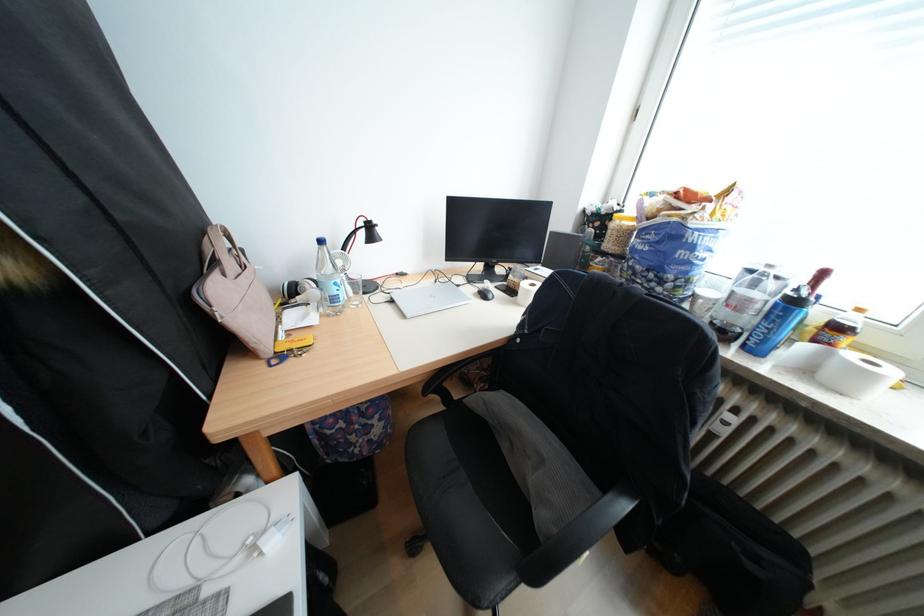
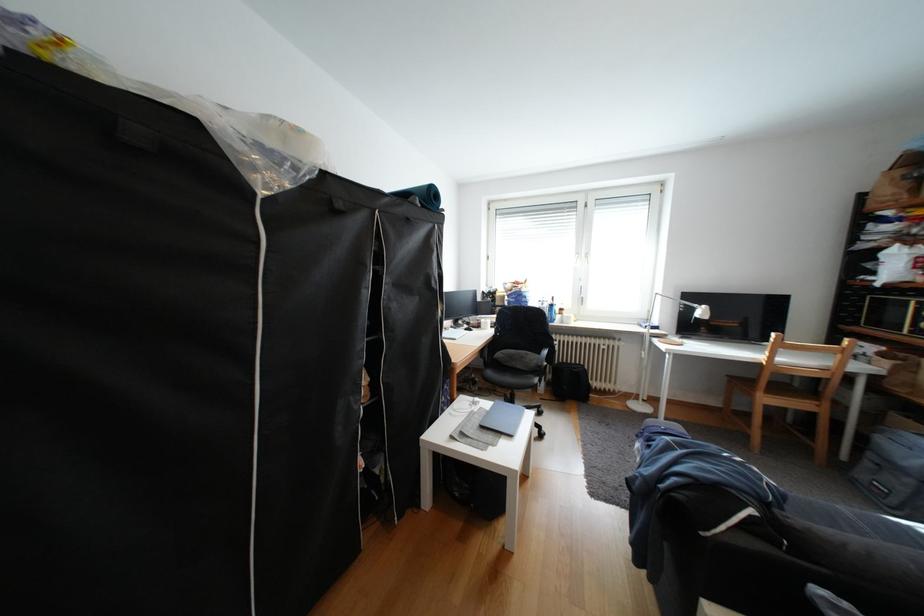
Question: I am providing you with two images of the same scene from different viewpoints. After the viewpoint changes to image2, which objects are now occluded?

Choices:
 (A) large blue bottle
 (B) blue water bottle
 (C) black chair armrest
 (D) blue rolled mat

Answer: (B)